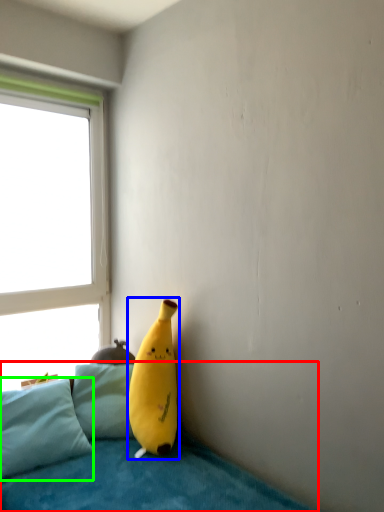
Question: Considering the real-world distances, which object is farthest from studio couch (highlighted by a red box)? banana (highlighted by a blue box) or pillow (highlighted by a green box)?

Choices:
 (A) banana
 (B) pillow

Answer: (A)